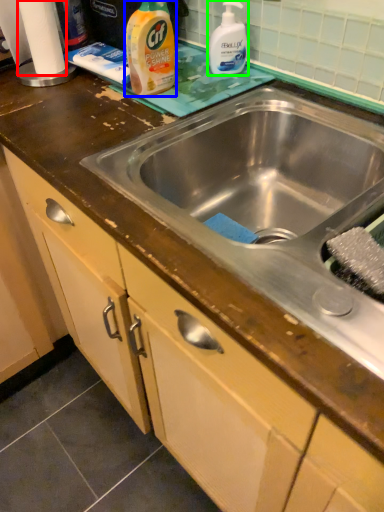
Question: Estimate the real-world distances between objects in this image. Which object is closer to toilet paper (highlighted by a red box), cleaning product (highlighted by a blue box) or cleaning product (highlighted by a green box)?

Choices:
 (A) cleaning product
 (B) cleaning product

Answer: (A)